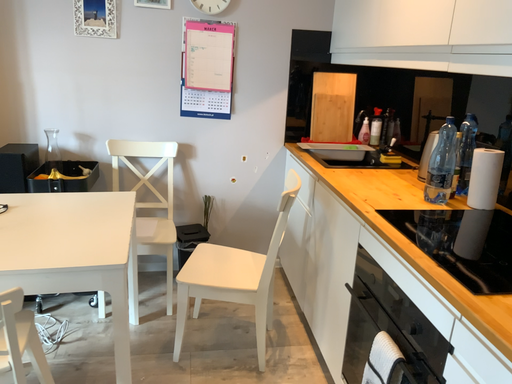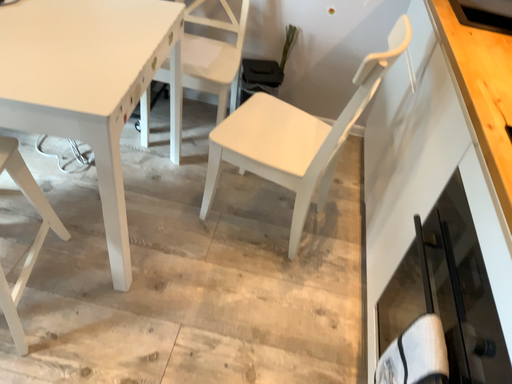
Question: Which way did the camera rotate in the video?

Choices:
 (A) rotated left
 (B) rotated right

Answer: (A)